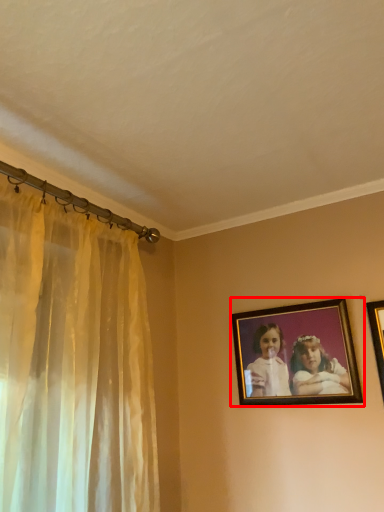
Question: From the image's perspective, where is picture frame (annotated by the red box) located relative to picture frame?

Choices:
 (A) above
 (B) below

Answer: (B)